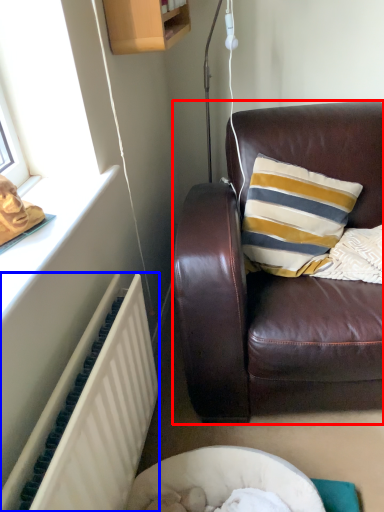
Question: Among these objects, which one is farthest to the camera, studio couch (highlighted by a red box) or radiator (highlighted by a blue box)?

Choices:
 (A) studio couch
 (B) radiator

Answer: (A)